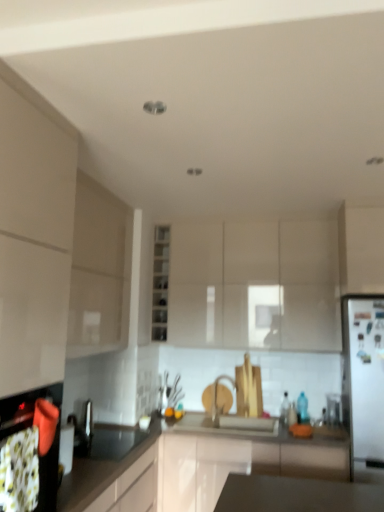
Question: Does white glossy cabinet at right, marked as the fifth cabinetry in a left-to-right arrangement, touch matte white cabinet at center, the 4th cabinetry when ordered from left to right?

Choices:
 (A) no
 (B) yes

Answer: (A)

Question: Does white glossy cabinet at right, which is the first cabinetry in right-to-left order, turn towards matte white cabinet at center, marked as the 2th cabinetry in a right-to-left arrangement?

Choices:
 (A) no
 (B) yes

Answer: (A)

Question: From the image's perspective, would you say white glossy cabinet at right, which is the first cabinetry in right-to-left order, is shown under matte white cabinet at center, marked as the 2th cabinetry in a right-to-left arrangement?

Choices:
 (A) yes
 (B) no

Answer: (B)

Question: Considering the relative sizes of white glossy cabinet at right, marked as the fifth cabinetry in a left-to-right arrangement, and matte white cabinet at center, the 4th cabinetry when ordered from left to right, in the image provided, is white glossy cabinet at right, marked as the fifth cabinetry in a left-to-right arrangement, thinner than matte white cabinet at center, the 4th cabinetry when ordered from left to right,?

Choices:
 (A) yes
 (B) no

Answer: (B)

Question: Is white glossy cabinet at right, which is the first cabinetry in right-to-left order, taller than matte white cabinet at center, marked as the 2th cabinetry in a right-to-left arrangement?

Choices:
 (A) yes
 (B) no

Answer: (B)

Question: Which is correct: white glossy cabinet at left, placed as the fifth cabinetry when sorted from right to left, is inside matte black oven at lower left, or outside of it?

Choices:
 (A) outside
 (B) inside

Answer: (A)

Question: From a real-world perspective, is white glossy cabinet at left, which is the first cabinetry in left-to-right order, physically located above or below matte black oven at lower left?

Choices:
 (A) above
 (B) below

Answer: (A)

Question: Is white glossy cabinet at left, placed as the fifth cabinetry when sorted from right to left, in front of or behind matte black oven at lower left in the image?

Choices:
 (A) front
 (B) behind

Answer: (A)

Question: Visually, is white glossy cabinet at left, placed as the fifth cabinetry when sorted from right to left, positioned to the left or to the right of matte black oven at lower left?

Choices:
 (A) right
 (B) left

Answer: (B)

Question: Is matte white cabinet at center, marked as the 2th cabinetry in a right-to-left arrangement, spatially inside black glossy countertop at lower left, or outside of it?

Choices:
 (A) inside
 (B) outside

Answer: (B)

Question: In the image, is matte white cabinet at center, the 4th cabinetry when ordered from left to right, positioned in front of or behind black glossy countertop at lower left?

Choices:
 (A) front
 (B) behind

Answer: (B)

Question: From a real-world perspective, is matte white cabinet at center, marked as the 2th cabinetry in a right-to-left arrangement, above or below black glossy countertop at lower left?

Choices:
 (A) above
 (B) below

Answer: (A)

Question: Would you say matte white cabinet at center, marked as the 2th cabinetry in a right-to-left arrangement, is to the left or to the right of black glossy countertop at lower left in the picture?

Choices:
 (A) left
 (B) right

Answer: (B)

Question: From a real-world perspective, relative to matte white cabinet at center, the 4th cabinetry when ordered from left to right, is white glossy cabinet at left, which is the first cabinetry in left-to-right order, vertically above or below?

Choices:
 (A) below
 (B) above

Answer: (A)

Question: From the image's perspective, is white glossy cabinet at left, which is the first cabinetry in left-to-right order, positioned above or below matte white cabinet at center, marked as the 2th cabinetry in a right-to-left arrangement?

Choices:
 (A) below
 (B) above

Answer: (B)